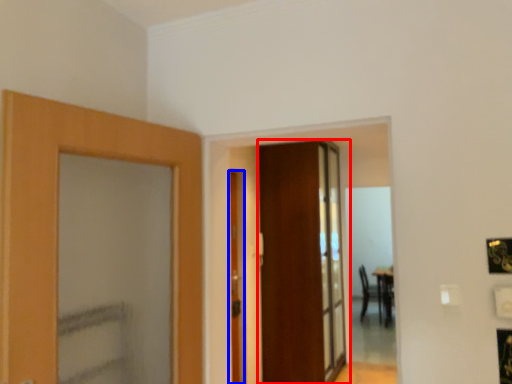
Question: Which object appears farthest to the camera in this image, door (highlighted by a red box) or door (highlighted by a blue box)?

Choices:
 (A) door
 (B) door

Answer: (A)